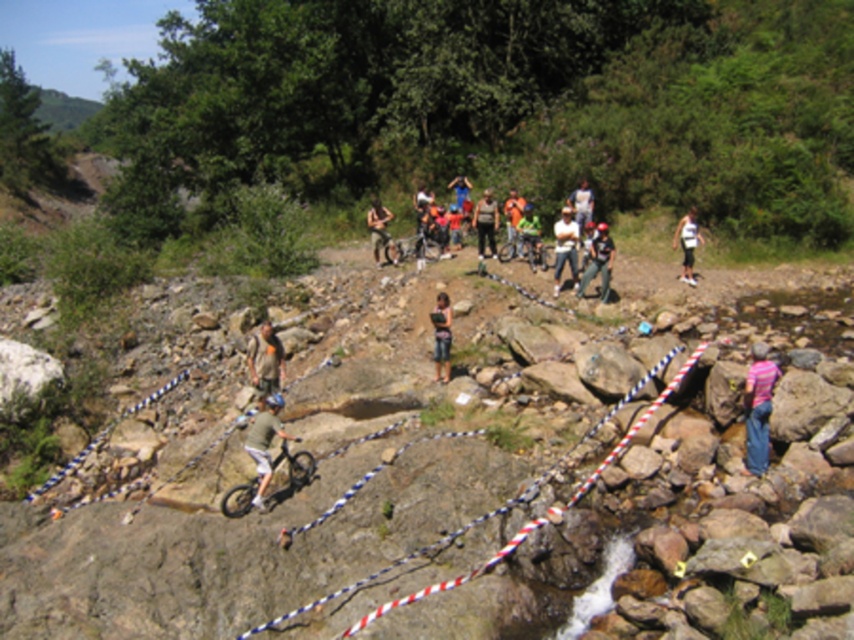
Is point (656, 401) positioned before point (237, 508)?

No, it is not.

Is white striped rope at center thinner than shiny metallic bicycle at center?

Yes.

Does point (381, 570) come closer to viewer compared to point (311, 465)?

Yes, point (381, 570) is in front of point (311, 465).

Image resolution: width=854 pixels, height=640 pixels. Identify the location of white striped rope at center. (408, 554).

Describe the element at coordinates (295, 465) in the screenshot. I see `shiny metallic bicycle at center` at that location.

Is shiny metallic bicycle at center smaller than denim pants at center?

Indeed, shiny metallic bicycle at center has a smaller size compared to denim pants at center.

Does point (275, 461) come behind point (586, 280)?

That is False.

The image size is (854, 640). I want to click on shiny metallic bicycle at center, so click(295, 465).

Which is in front, point (756, 449) or point (378, 198)?

Point (756, 449) is more forward.

Locate an element on the screen. This screenshot has width=854, height=640. pink striped shirt at lower right is located at coordinates (758, 406).